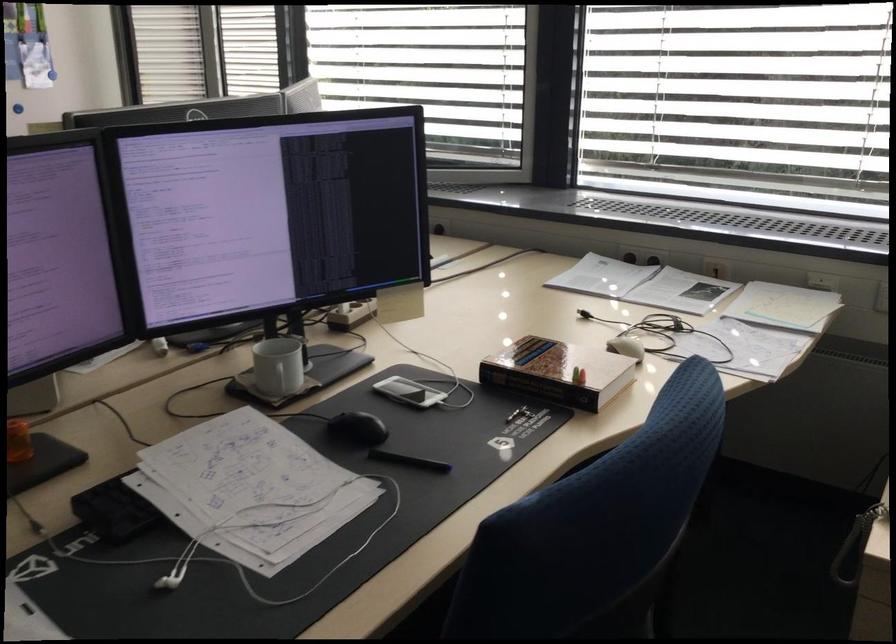
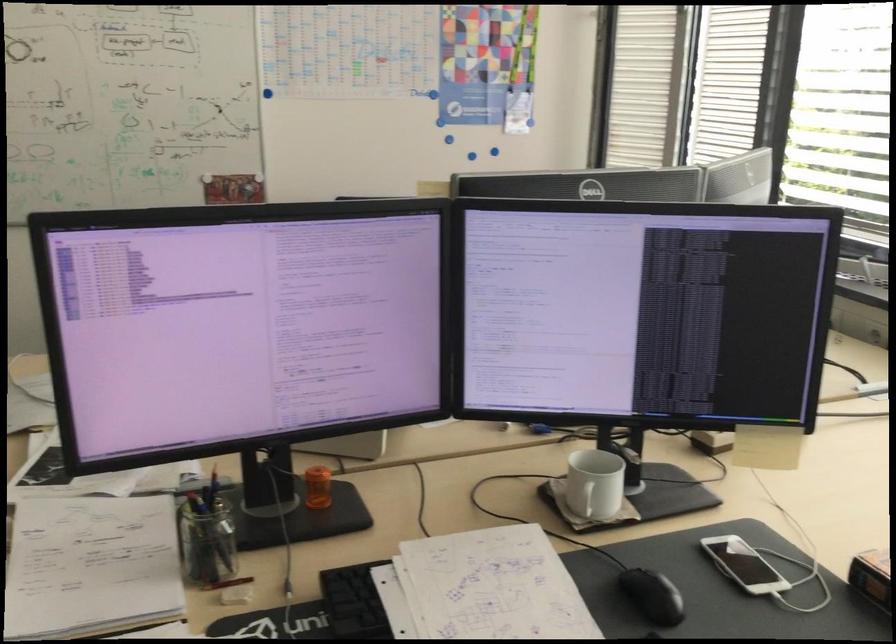
Question: The camera is either moving clockwise (left) or counter-clockwise (right) around the object. The first image is from the beginning of the video and the second image is from the end. Is the camera moving left or right when shooting the video?

Choices:
 (A) Left
 (B) Right

Answer: (B)